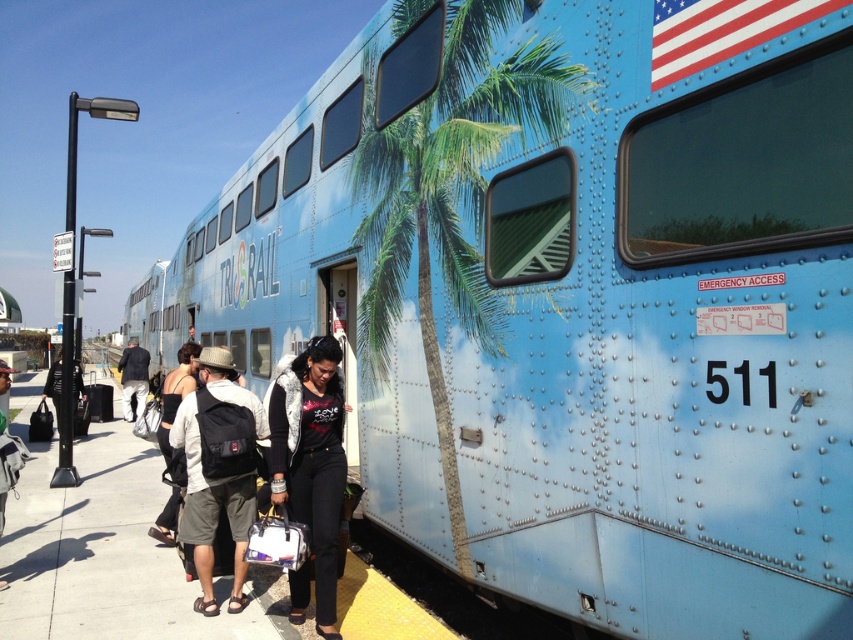
Question: Based on their relative distances, which object is farther from the green leafy palm tree at center?

Choices:
 (A) black fur vest at center
 (B) white cotton shirt at center
 (C) black fabric backpack at center
 (D) dark blue jeans at center

Answer: (D)

Question: Which point is farther from the camera taking this photo?

Choices:
 (A) (193, 422)
 (B) (13, 452)
 (C) (184, 392)
 (D) (334, 472)

Answer: (C)

Question: Which point is closer to the camera taking this photo?

Choices:
 (A) (163, 520)
 (B) (328, 531)
 (C) (7, 444)

Answer: (B)

Question: Does green leafy palm tree at center have a greater width compared to black fabric backpack at center?

Choices:
 (A) yes
 (B) no

Answer: (A)

Question: Where is green leafy palm tree at center located in relation to denim jacket at lower left in the image?

Choices:
 (A) left
 (B) right

Answer: (B)

Question: Does white cotton shirt at center have a smaller size compared to dark blue jeans at center?

Choices:
 (A) no
 (B) yes

Answer: (B)